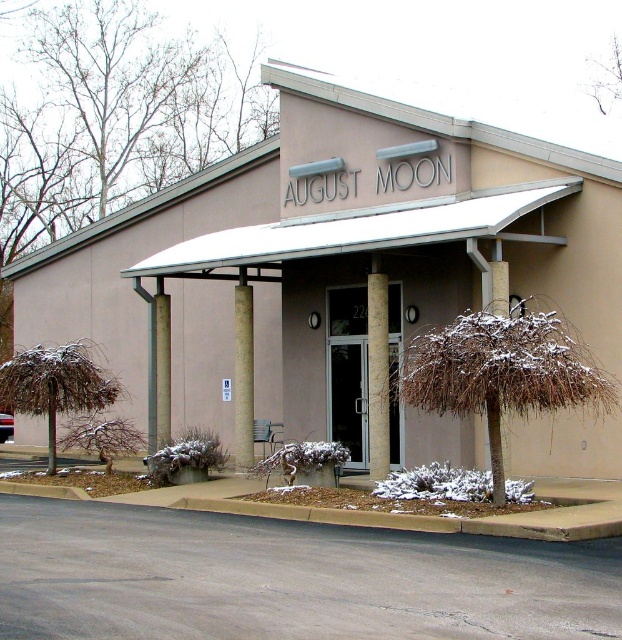
Which is behind, point (200, 180) or point (243, 416)?

Point (200, 180)

Can you confirm if beige concrete building at center is bigger than gray concrete column at center?

Yes, beige concrete building at center is bigger than gray concrete column at center.

This screenshot has width=622, height=640. Find the location of `beige concrete building at center`. beige concrete building at center is located at coordinates (332, 253).

Is beige concrete pillar at center positioned before gray concrete pillar at center?

Yes, beige concrete pillar at center is closer to the viewer.

Is beige concrete pillar at center wider than gray concrete pillar at center?

No.

Is point (369, 394) less distant than point (160, 349)?

Yes.

Find the location of a particular element. beige concrete pillar at center is located at coordinates (378, 376).

The width and height of the screenshot is (622, 640). In order to click on beige concrete pillar at center in this screenshot , I will do `click(378, 376)`.

Is beige concrete pillar at center further to camera compared to gray concrete column at center?

No.

The height and width of the screenshot is (640, 622). Find the location of `beige concrete pillar at center`. beige concrete pillar at center is located at coordinates (378, 376).

This screenshot has height=640, width=622. What are the coordinates of `beige concrete pillar at center` in the screenshot? It's located at (378, 376).